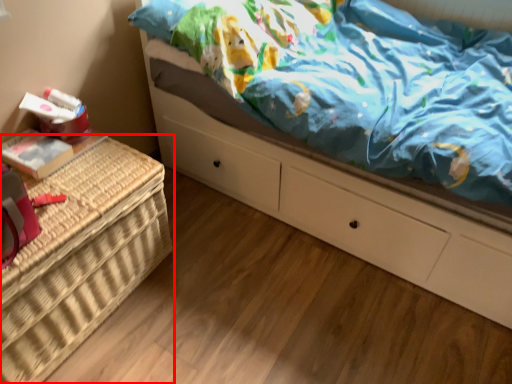
Question: From the image's perspective, where is furniture (annotated by the red box) located relative to bed?

Choices:
 (A) above
 (B) below

Answer: (B)